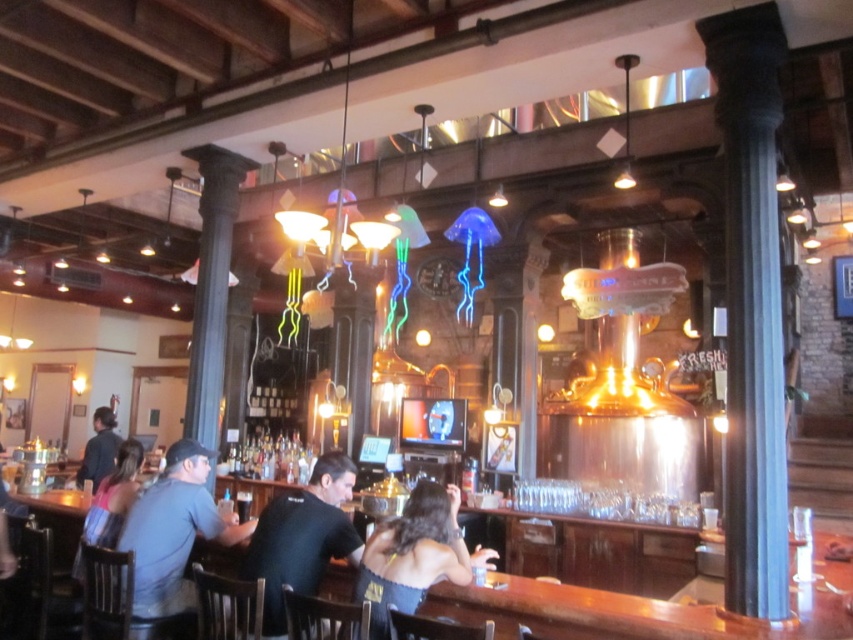
Does dark blue shirt at lower left appear under black satin dress at center?

Yes.

Is dark blue shirt at lower left to the left of black satin dress at center from the viewer's perspective?

Yes, dark blue shirt at lower left is to the left of black satin dress at center.

Is point (171, 452) farther from camera compared to point (370, 632)?

Yes, it is.

Locate an element on the screen. dark blue shirt at lower left is located at coordinates tap(173, 531).

Based on the photo, is the position of black satin dress at center more distant than that of dark blue shirt at left?

No.

Can you confirm if black satin dress at center is thinner than dark blue shirt at left?

Incorrect, black satin dress at center's width is not less than dark blue shirt at left's.

Between point (373, 596) and point (93, 483), which one is positioned in front?

Point (373, 596)

The image size is (853, 640). I want to click on black satin dress at center, so click(x=412, y=554).

Is black t-shirt at center wider than black satin dress at center?

No.

Who is positioned more to the right, black t-shirt at center or black satin dress at center?

black satin dress at center

I want to click on black t-shirt at center, so click(x=302, y=538).

This screenshot has width=853, height=640. Find the location of `black t-shirt at center`. black t-shirt at center is located at coordinates (302, 538).